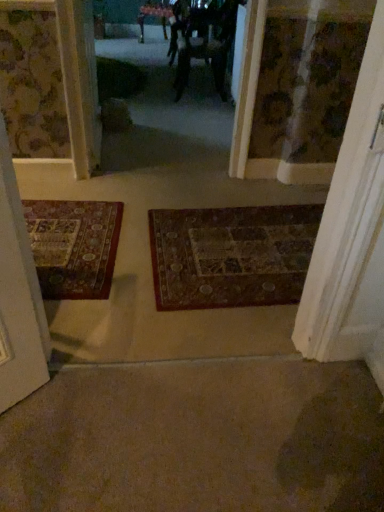
Question: Do you think dark brown woven mat at center is within metallic silver mirror at upper center, or outside of it?

Choices:
 (A) outside
 (B) inside

Answer: (A)

Question: In terms of height, does dark brown woven mat at center look taller or shorter compared to metallic silver mirror at upper center?

Choices:
 (A) short
 (B) tall

Answer: (A)

Question: Which of these objects is positioned closest to the wooden door at right?

Choices:
 (A) dark brown woven mat at center
 (B) metallic silver mirror at upper center
 (C) dark fabric couple at center

Answer: (A)

Question: Estimate the real-world distances between objects in this image. Which object is farther from the wooden door at right?

Choices:
 (A) dark brown woven mat at center
 (B) dark fabric couple at center
 (C) metallic silver mirror at upper center

Answer: (C)